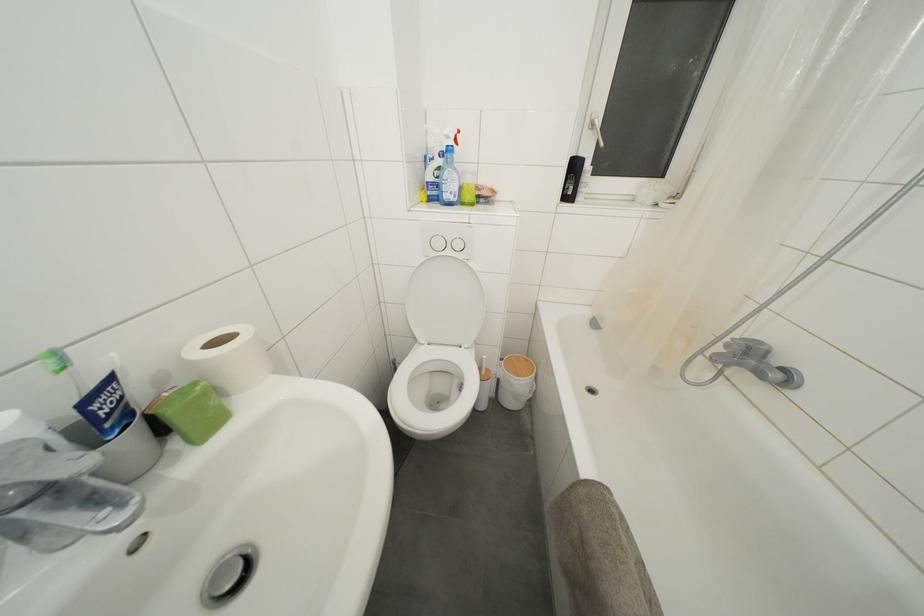
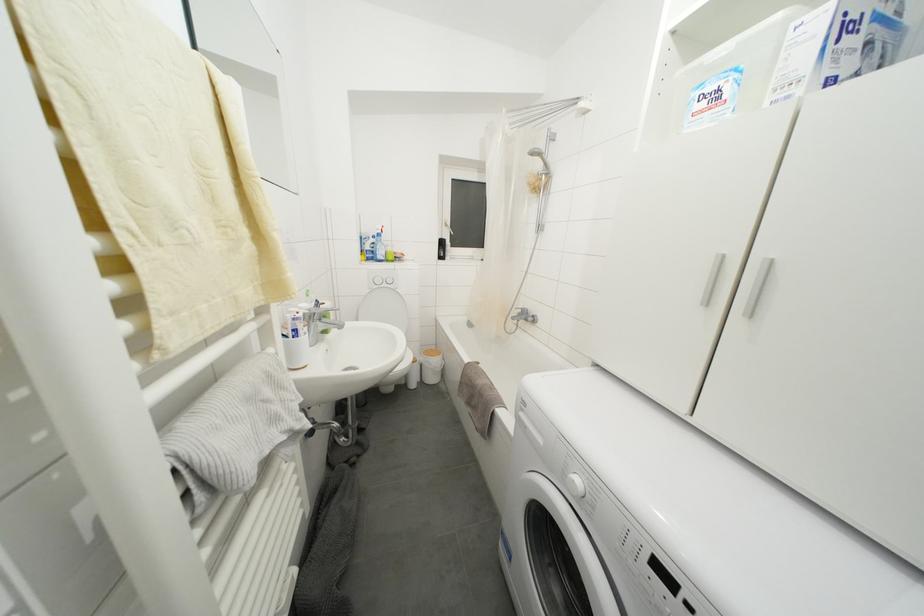
What movement of the cameraman would produce the second image?

The movement direction of the cameraman is left, backward.